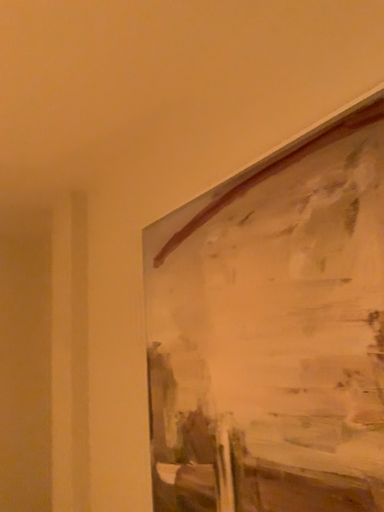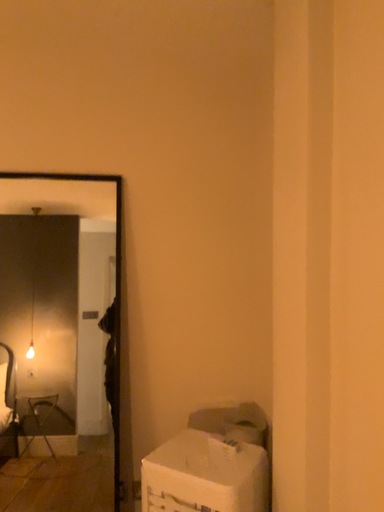
Question: How did the camera likely rotate when shooting the video?

Choices:
 (A) rotated left
 (B) rotated right

Answer: (A)